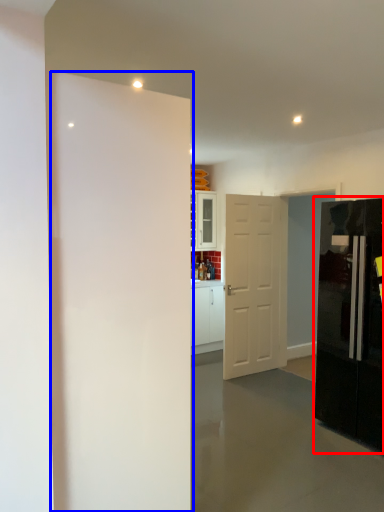
Question: Which of the following is the farthest to the observer, refrigerator (highlighted by a red box) or door (highlighted by a blue box)?

Choices:
 (A) refrigerator
 (B) door

Answer: (A)